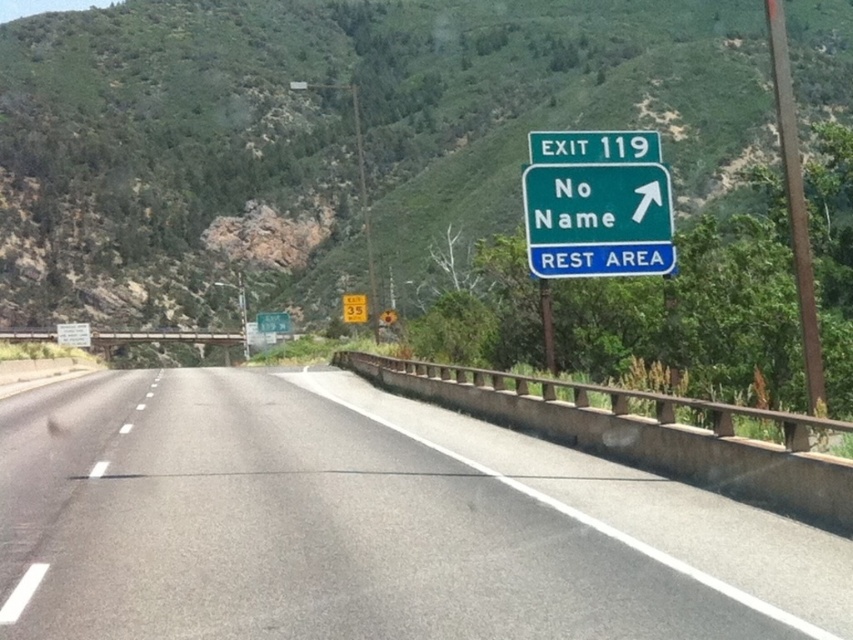
You are driving on the highway and see two points marked on the road ahead. The first point is at coordinates point (627, 218) and the second point is at point (576, 150). According to the scene description, which point is closer to your current position?

Point (627, 218) is in front of point (576, 150), so the first point is closer to your current position.

You are driving on a highway and see the road sign indicating EXIT 119 towards No Name REST AREA. There is also a smaller blue sign with white text that reads REST AREA. You notice a point at coordinates [328,134]. What is located at that point?

At point [328,134] lies green forested mountain at upper center.

You are driving on the highway and see two signs at the upper right corner of your view. The green glossy sign at upper right and the green metallic sign at upper right. Which one takes up more space in your view?

The green metallic sign at upper right takes up more space in your view because the green glossy sign at upper right occupies less space than the green metallic sign at upper right.